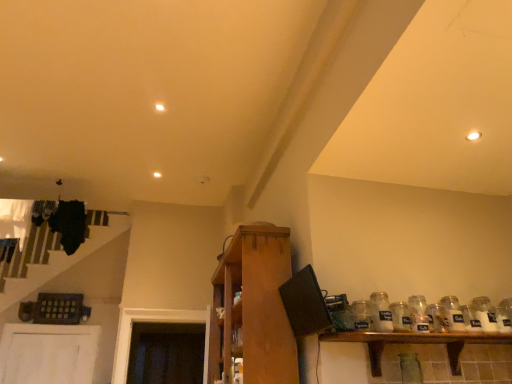
Question: Is clear glass jar at shelf right, which is the 4th glass jar in right-to-left order, aimed at clear glass jar at right, placed as the second glass bottle when sorted from right to left?

Choices:
 (A) no
 (B) yes

Answer: (A)

Question: Can clear glass jar at right, placed as the second glass bottle when sorted from right to left, be found inside clear glass jar at shelf right, which is the 1th glass jar from left to right?

Choices:
 (A) yes
 (B) no

Answer: (B)

Question: Can you confirm if clear glass jar at shelf right, which is the 4th glass jar in right-to-left order, is bigger than clear glass jar at right, which is counted as the 2th glass bottle, starting from the left?

Choices:
 (A) no
 (B) yes

Answer: (A)

Question: Is clear glass jar at shelf right, which is the 4th glass jar in right-to-left order, outside clear glass jar at right, which is counted as the 2th glass bottle, starting from the left?

Choices:
 (A) yes
 (B) no

Answer: (A)

Question: Is clear glass jar at shelf right, which is the 1th glass jar from left to right, smaller than clear glass jar at right, placed as the second glass bottle when sorted from right to left?

Choices:
 (A) no
 (B) yes

Answer: (B)

Question: Considering their positions, is white glass jar at right, which is the 3th glass bottle in right-to-left order, located in front of or behind clear glass jar at right, which appears as the 3th glass jar when viewed from the right?

Choices:
 (A) behind
 (B) front

Answer: (B)

Question: In terms of size, does white glass jar at right, marked as the 1th glass bottle in a left-to-right arrangement, appear bigger or smaller than clear glass jar at right, the 2th glass jar viewed from the left?

Choices:
 (A) big
 (B) small

Answer: (A)

Question: Is white glass jar at right, which is the 3th glass bottle in right-to-left order, taller or shorter than clear glass jar at right, which appears as the 3th glass jar when viewed from the right?

Choices:
 (A) short
 (B) tall

Answer: (B)

Question: From the image's perspective, is white glass jar at right, which is the 3th glass bottle in right-to-left order, positioned above or below clear glass jar at right, the 2th glass jar viewed from the left?

Choices:
 (A) below
 (B) above

Answer: (B)

Question: Would you say wooden cabinet at center, positioned as the second shelf in right-to-left order, is to the left or to the right of clear glass jar at right, which is counted as the 2th glass bottle, starting from the left, in the picture?

Choices:
 (A) left
 (B) right

Answer: (A)

Question: Looking at the image, does wooden cabinet at center, positioned as the second shelf in right-to-left order, seem bigger or smaller compared to clear glass jar at right, which is counted as the 2th glass bottle, starting from the left?

Choices:
 (A) small
 (B) big

Answer: (B)

Question: Would you say wooden cabinet at center, which ranks as the first shelf in left-to-right order, is inside or outside clear glass jar at right, which is counted as the 2th glass bottle, starting from the left?

Choices:
 (A) inside
 (B) outside

Answer: (B)

Question: From the image's perspective, is wooden cabinet at center, positioned as the second shelf in right-to-left order, positioned above or below clear glass jar at right, placed as the second glass bottle when sorted from right to left?

Choices:
 (A) above
 (B) below

Answer: (B)

Question: From a real-world perspective, is white glass jar at right, which is the 3th glass bottle in right-to-left order, physically located above or below wooden cabinet at center, which ranks as the first shelf in left-to-right order?

Choices:
 (A) below
 (B) above

Answer: (A)

Question: From the image's perspective, is white glass jar at right, marked as the 1th glass bottle in a left-to-right arrangement, above or below wooden cabinet at center, which ranks as the first shelf in left-to-right order?

Choices:
 (A) below
 (B) above

Answer: (B)